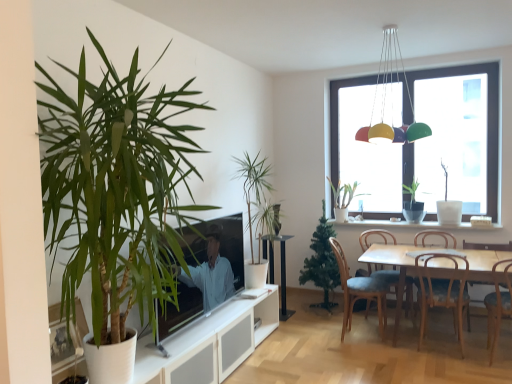
Question: From the image's perspective, is wooden chair at lower right, which is counted as the 5th chair, starting from the left, located above or below green matte plant at window, arranged as the fifth houseplant when viewed from the front?

Choices:
 (A) below
 (B) above

Answer: (A)

Question: Relative to green matte plant at window, the 2th houseplant in the back-to-front sequence, is wooden chair at lower right, the 1th chair viewed from the right, in front or behind?

Choices:
 (A) front
 (B) behind

Answer: (A)

Question: Which of these objects is positioned farthest from the wooden chair at lower right, positioned as the 3th chair in right-to-left order?

Choices:
 (A) brown wooden chair at lower right, placed as the 4th chair when sorted from left to right
 (B) black glass table at center
 (C) wooden chair at lower right, the 1th chair viewed from the right
 (D) green leafy plant at left, the 6th houseplant in the right-to-left sequence
 (E) multicolored plastic light fixture at upper center

Answer: (D)

Question: Which of these objects is positioned closest to the brown wooden chair at lower right, placed as the 4th chair when sorted from left to right?

Choices:
 (A) green matte christmas tree at center, the 4th houseplant when ordered from right to left
 (B) multicolored plastic light fixture at upper center
 (C) wooden chair at lower right
 (D) green matte plant at window, the second houseplant positioned from the right
 (E) black glass table at center

Answer: (C)